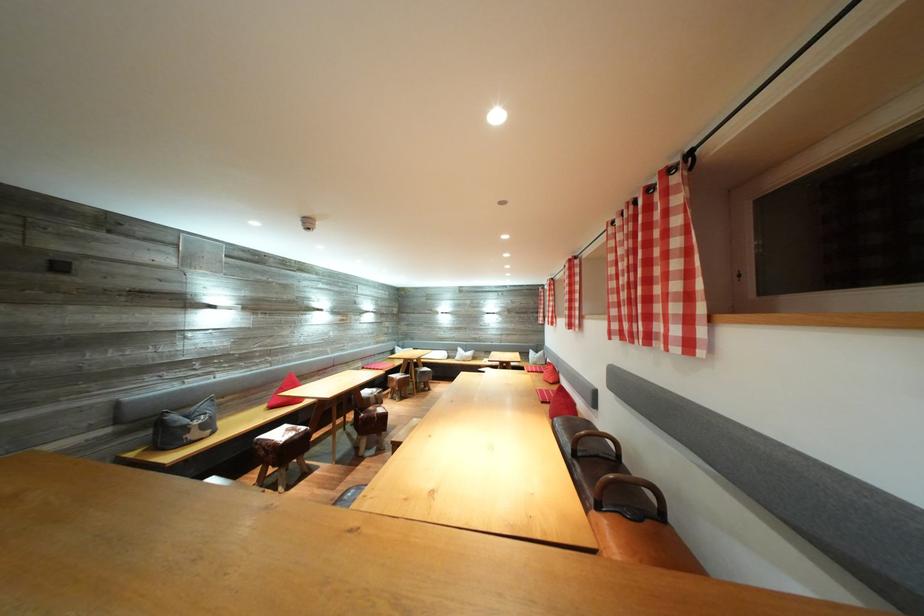
You are a GUI agent. You are given a task and a screenshot of the screen. Output one action in this format:
    pyautogui.click(x=<x>, y=<y>)
    Task: Click on the sofa sitting surface
    This screenshot has width=924, height=616.
    Given the screenshot: What is the action you would take?
    pyautogui.click(x=635, y=522)